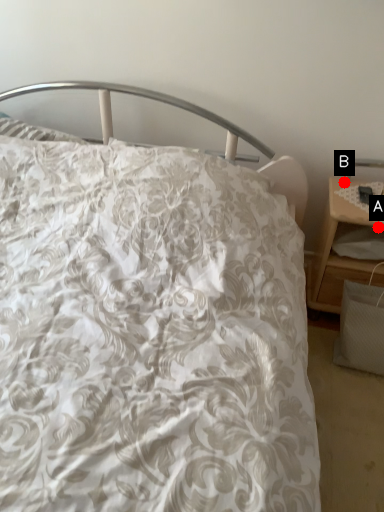
Question: Two points are circled on the image, labeled by A and B beside each circle. Which point appears closest to the camera in this image?

Choices:
 (A) A is closer
 (B) B is closer

Answer: (A)